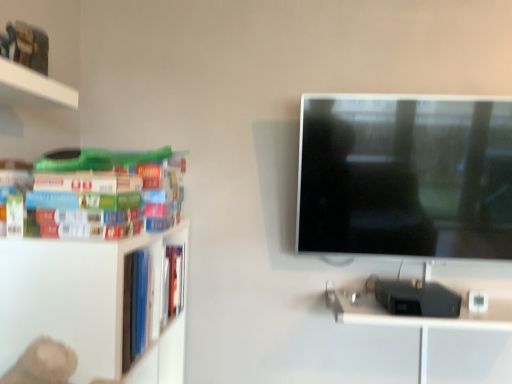
I want to click on hardcover books at left, so click(x=100, y=194).

This screenshot has height=384, width=512. Describe the element at coordinates (100, 194) in the screenshot. I see `hardcover books at left` at that location.

Measure the distance between point (457,319) and camera.

The depth of point (457,319) is 1.52 meters.

Based on the photo, measure the distance between metallic silver computer desk at lower right and camera.

The distance of metallic silver computer desk at lower right from camera is 4.79 feet.

At what (x,y) coordinates should I click in order to perform the action: click on metallic silver computer desk at lower right. Please return your answer as a coordinate pair (x, y). This screenshot has height=384, width=512. Looking at the image, I should click on (421, 316).

Describe the element at coordinates (421, 316) in the screenshot. I see `metallic silver computer desk at lower right` at that location.

The image size is (512, 384). What are the coordinates of `hardcover books at left` in the screenshot? It's located at (100, 194).

Consider the image. Is metallic silver computer desk at lower right to the left or to the right of hardcover books at left in the image?

Clearly, metallic silver computer desk at lower right is on the right of hardcover books at left in the image.

Is the position of metallic silver computer desk at lower right more distant than that of hardcover books at left?

Yes.

Considering the positions of point (372, 301) and point (23, 226), is point (372, 301) closer or farther from the camera than point (23, 226)?

Point (372, 301) is farther from the camera than point (23, 226).

From the picture: From the image's perspective, between metallic silver computer desk at lower right and hardcover books at left, which one is located above?

hardcover books at left is shown above in the image.

From a real-world perspective, which object rests below the other?

In real-world perspective, metallic silver computer desk at lower right is lower.

Which of these two, metallic silver computer desk at lower right or hardcover books at left, is thinner?

With smaller width is hardcover books at left.

Which of these two, metallic silver computer desk at lower right or hardcover books at left, stands shorter?

Standing shorter between the two is metallic silver computer desk at lower right.

Can you confirm if metallic silver computer desk at lower right is smaller than hardcover books at left?

Actually, metallic silver computer desk at lower right might be larger than hardcover books at left.

Is metallic silver computer desk at lower right completely or partially outside of hardcover books at left?

Yes.

Is metallic silver computer desk at lower right positioned far away from hardcover books at left?

That's not correct — metallic silver computer desk at lower right is a little close to hardcover books at left.

Is hardcover books at left at the back of metallic silver computer desk at lower right?

No.

Can you tell me how much metallic silver computer desk at lower right and hardcover books at left differ in facing direction?

There is a 89.9-degree angle between the facing directions of metallic silver computer desk at lower right and hardcover books at left.

Measure the distance from metallic silver computer desk at lower right to hardcover books at left.

They are 37.46 inches apart.

I want to click on computer desk below the hardcover books at left (from a real-world perspective), so click(421, 316).

Would you say hardcover books at left is to the left or to the right of metallic silver computer desk at lower right in the picture?

hardcover books at left is to the left of metallic silver computer desk at lower right.

Does hardcover books at left lie in front of metallic silver computer desk at lower right?

Yes, hardcover books at left is closer to the camera.

Looking at this image, which is less distant, (14, 219) or (339, 310)?

The point (14, 219) is in front.

From the image's perspective, between hardcover books at left and metallic silver computer desk at lower right, who is located below?

metallic silver computer desk at lower right appears lower in the image.

From a real-world perspective, is hardcover books at left beneath metallic silver computer desk at lower right?

No, from a real-world perspective, hardcover books at left is not under metallic silver computer desk at lower right.

Considering the sizes of hardcover books at left and metallic silver computer desk at lower right in the image, is hardcover books at left wider or thinner than metallic silver computer desk at lower right?

Considering their sizes, hardcover books at left looks slimmer than metallic silver computer desk at lower right.

Is hardcover books at left taller or shorter than metallic silver computer desk at lower right?

In the image, hardcover books at left appears to be taller than metallic silver computer desk at lower right.

Which of these two, hardcover books at left or metallic silver computer desk at lower right, is smaller?

hardcover books at left is smaller.

Is hardcover books at left outside of metallic silver computer desk at lower right?

hardcover books at left lies outside metallic silver computer desk at lower right's area.

Is hardcover books at left not near metallic silver computer desk at lower right?

No, hardcover books at left is not far from metallic silver computer desk at lower right.

Does hardcover books at left turn towards metallic silver computer desk at lower right?

Yes, hardcover books at left faces towards metallic silver computer desk at lower right.

What's the angular difference between hardcover books at left and metallic silver computer desk at lower right's facing directions?

They differ by 89.9 degrees in their facing directions.

Locate an element on the screen. The height and width of the screenshot is (384, 512). computer desk that appears below the hardcover books at left (from a real-world perspective) is located at coordinates (421, 316).

The image size is (512, 384). Find the location of `computer desk that is under the hardcover books at left (from a real-world perspective)`. computer desk that is under the hardcover books at left (from a real-world perspective) is located at coordinates (421, 316).

Where is `computer desk below the hardcover books at left (from the image's perspective)`? The height and width of the screenshot is (384, 512). computer desk below the hardcover books at left (from the image's perspective) is located at coordinates (421, 316).